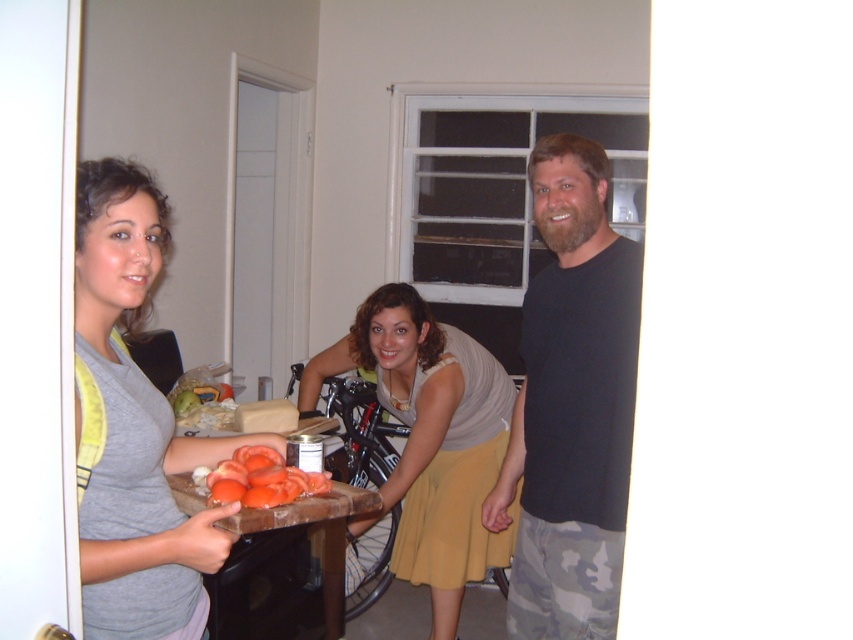
Measure the distance between black matte t-shirt at right and wooden cutting board at center.

black matte t-shirt at right and wooden cutting board at center are 78.67 centimeters apart.

Does black matte t-shirt at right come behind wooden cutting board at center?

That is False.

Identify the location of black matte t-shirt at right. This screenshot has height=640, width=853. (572, 404).

What do you see at coordinates (293, 548) in the screenshot? This screenshot has width=853, height=640. I see `wooden cutting board at center` at bounding box center [293, 548].

Locate an element on the screen. The width and height of the screenshot is (853, 640). wooden cutting board at center is located at coordinates (293, 548).

Between point (216, 593) and point (263, 449), which one is positioned behind?

Positioned behind is point (216, 593).

Locate an element on the screen. wooden cutting board at center is located at coordinates (293, 548).

Which is more to the left, matte gray tank top at center or smooth orange tomatoes at center?

smooth orange tomatoes at center is more to the left.

Can you confirm if matte gray tank top at center is thinner than smooth orange tomatoes at center?

No, matte gray tank top at center is not thinner than smooth orange tomatoes at center.

The height and width of the screenshot is (640, 853). What do you see at coordinates (430, 438) in the screenshot?
I see `matte gray tank top at center` at bounding box center [430, 438].

Where is `matte gray tank top at center`? matte gray tank top at center is located at coordinates (430, 438).